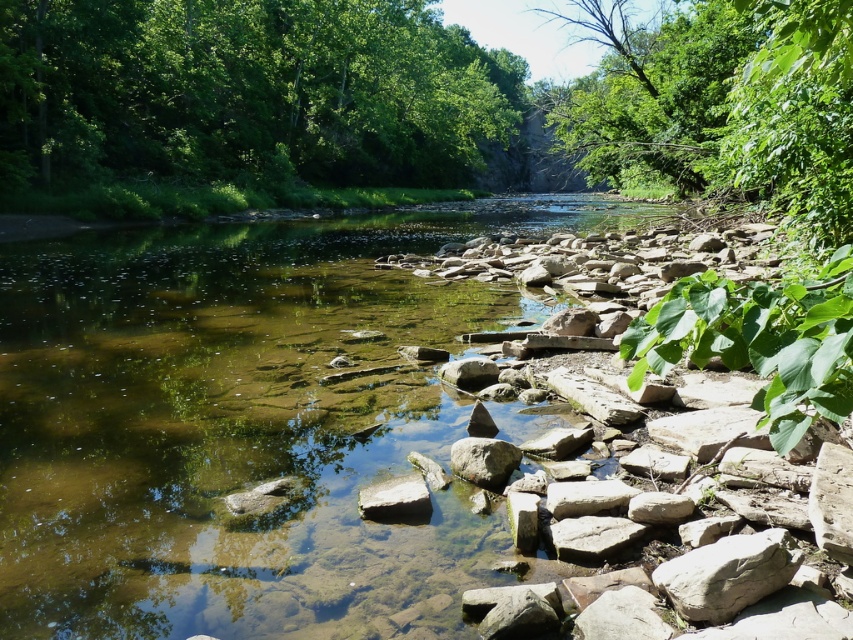
Question: Estimate the real-world distances between objects in this image. Which object is closer to the green leafy trees at upper left?

Choices:
 (A) gray rough rock at lower right
 (B) smooth gray rock at lower center

Answer: (A)

Question: Is gray rough rock at lower right below smooth gray rock at center?

Choices:
 (A) yes
 (B) no

Answer: (A)

Question: Can you confirm if gray rough rock at lower right is wider than smooth gray rock at lower center?

Choices:
 (A) no
 (B) yes

Answer: (B)

Question: Is gray rough rock at lower right thinner than smooth gray rock at center?

Choices:
 (A) no
 (B) yes

Answer: (A)

Question: Which point is closer to the camera?

Choices:
 (A) smooth gray rock at center
 (B) smooth gray rock at lower center
 (C) gray rough rock at lower right
 (D) green leafy trees at upper left

Answer: (C)

Question: Which point is closer to the camera taking this photo?

Choices:
 (A) (231, 90)
 (B) (376, 492)

Answer: (B)